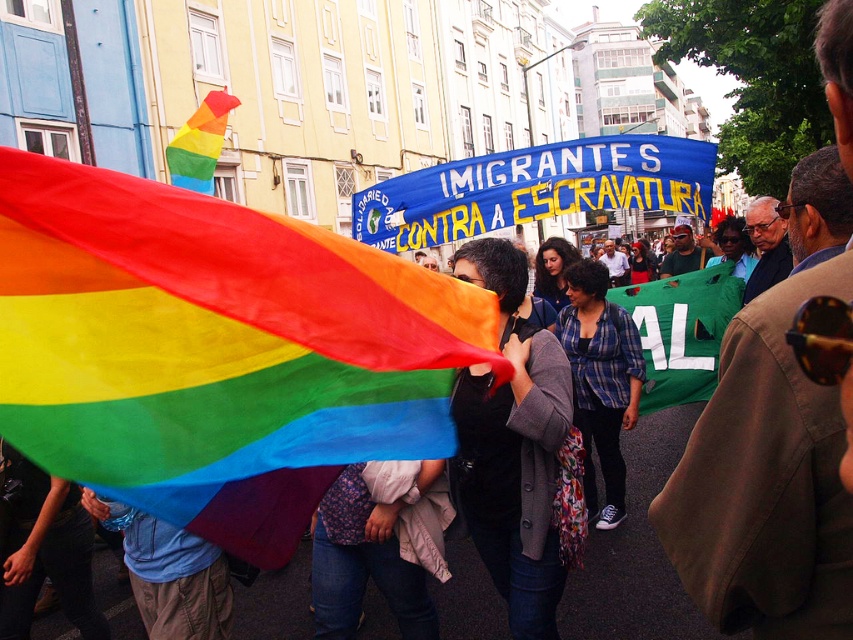
Is denim pants at lower left behind rainbow fabric flag at upper left?

No, denim pants at lower left is closer to the viewer.

Is point (169, 598) farther from viewer compared to point (218, 104)?

No, (169, 598) is in front of (218, 104).

Between point (207, 561) and point (180, 156), which one is positioned in front?

Point (207, 561) is in front.

The image size is (853, 640). Find the location of `denim pants at lower left`. denim pants at lower left is located at coordinates (177, 580).

Which of these two, blue plaid shirt at center or denim pants at lower left, stands taller?

With more height is blue plaid shirt at center.

Can you confirm if blue plaid shirt at center is smaller than denim pants at lower left?

Actually, blue plaid shirt at center might be larger than denim pants at lower left.

What do you see at coordinates (601, 381) in the screenshot? I see `blue plaid shirt at center` at bounding box center [601, 381].

Where is `blue plaid shirt at center`? blue plaid shirt at center is located at coordinates (601, 381).

Describe the element at coordinates (512, 445) in the screenshot. Image resolution: width=853 pixels, height=640 pixels. I see `matte black jacket at center` at that location.

Is matte black jacket at center below blue plaid shirt at center?

Yes.

Between point (537, 557) and point (595, 490), which one is positioned in front?

Point (537, 557) is more forward.

At what (x,y) coordinates should I click in order to perform the action: click on matte black jacket at center. Please return your answer as a coordinate pair (x, y). This screenshot has width=853, height=640. Looking at the image, I should click on (512, 445).